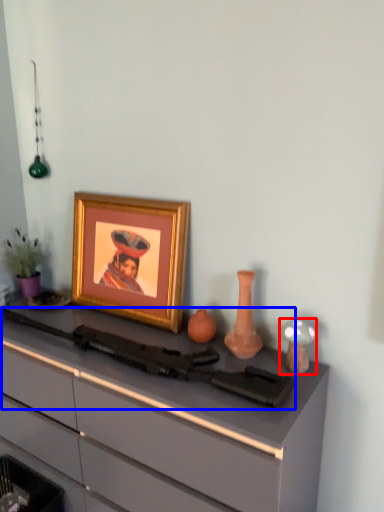
Question: Which object appears farthest to the camera in this image, candle holder (highlighted by a red box) or rifle (highlighted by a blue box)?

Choices:
 (A) candle holder
 (B) rifle

Answer: (A)